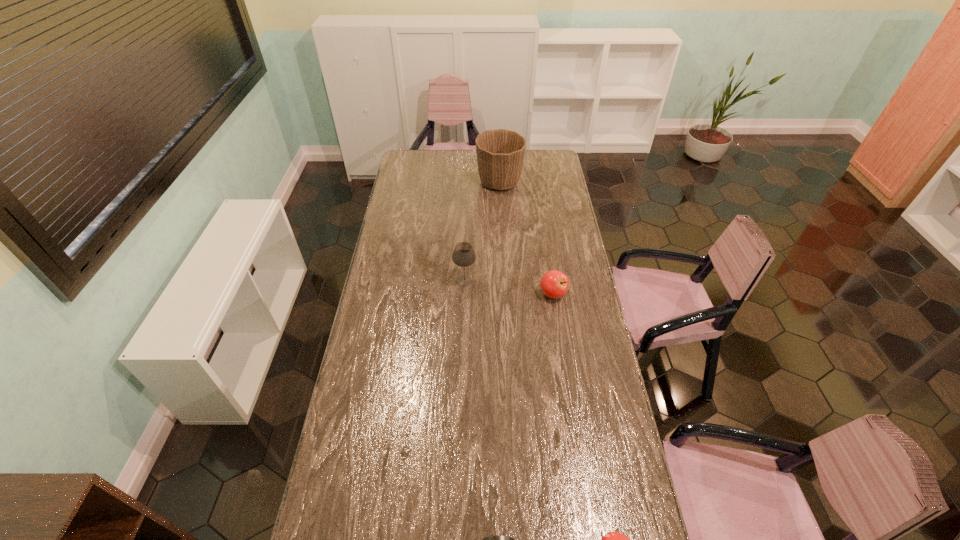
Locate an element on the screen. The height and width of the screenshot is (540, 960). vacant space at the left edge of the desktop is located at coordinates (401, 178).

The image size is (960, 540). Identify the location of vacant space at the right edge of the desktop. (540, 192).

Find the location of a particular element. The image size is (960, 540). vacant region between the taller apple and the flowerpot is located at coordinates 526,238.

Where is `free point between the farther apple and the second tallest object`? free point between the farther apple and the second tallest object is located at coordinates (509, 287).

Locate an element on the screen. This screenshot has width=960, height=540. vacant space that's between the tallest object and the wineglass is located at coordinates (482, 232).

Find the location of `the closest object to the taller apple`. the closest object to the taller apple is located at coordinates (463, 255).

Identify the location of object that ranks as the fourth closest to the farther apple. This screenshot has height=540, width=960. coord(490,539).